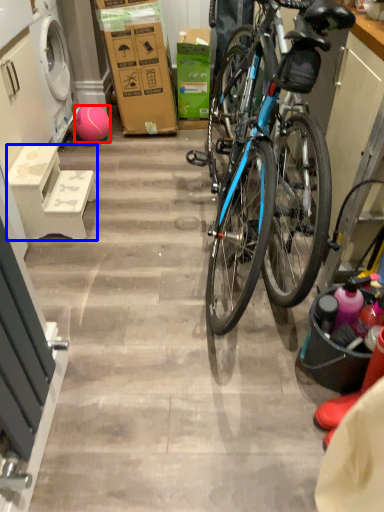
Question: Which point is closer to the camera, ball (highlighted by a red box) or stool (highlighted by a blue box)?

Choices:
 (A) ball
 (B) stool

Answer: (B)